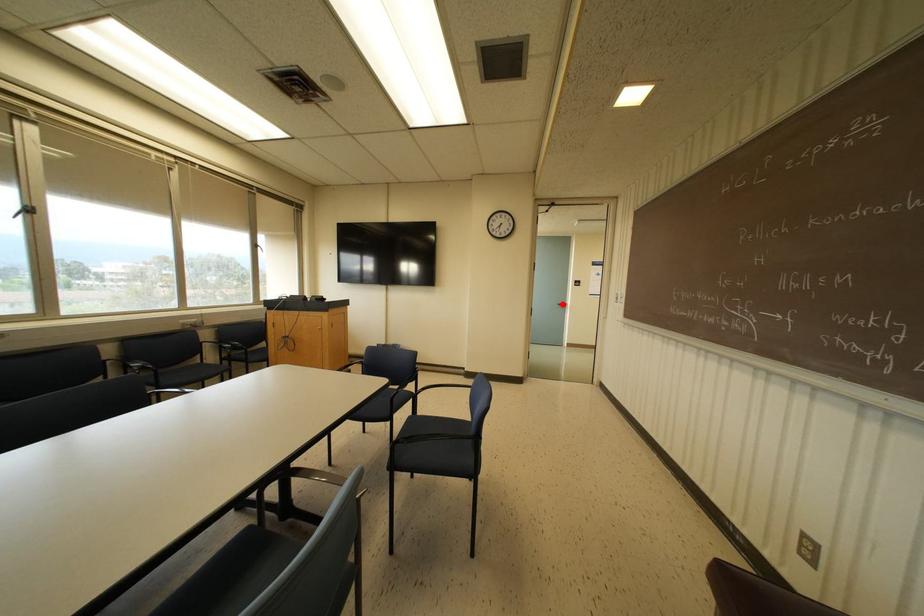
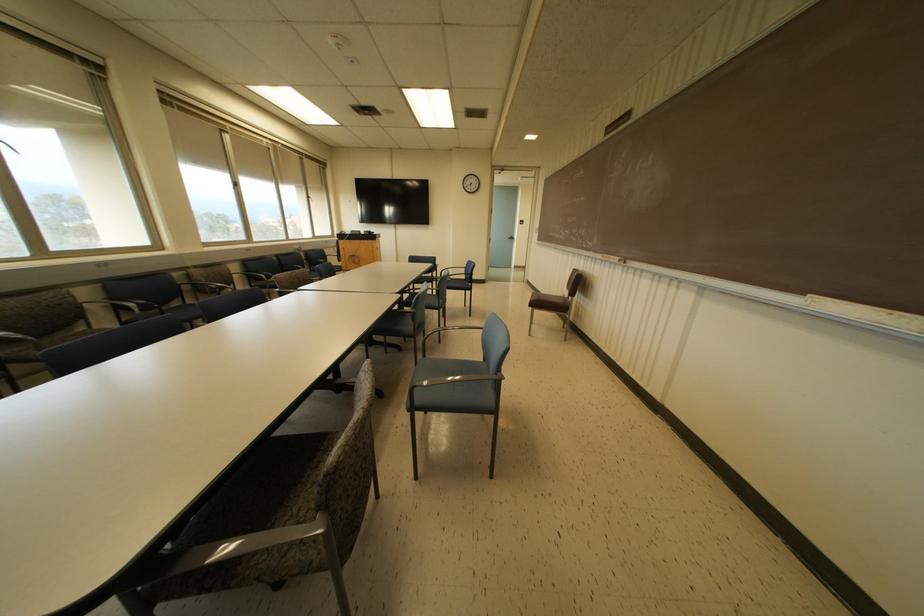
Question: I am providing you with two images of the same scene from different viewpoints. Given a red point in image1, look at the same physical point in image2. Is it:

Choices:
 (A) Closer to the viewpoint
 (B) Farther from the viewpoint

Answer: (A)